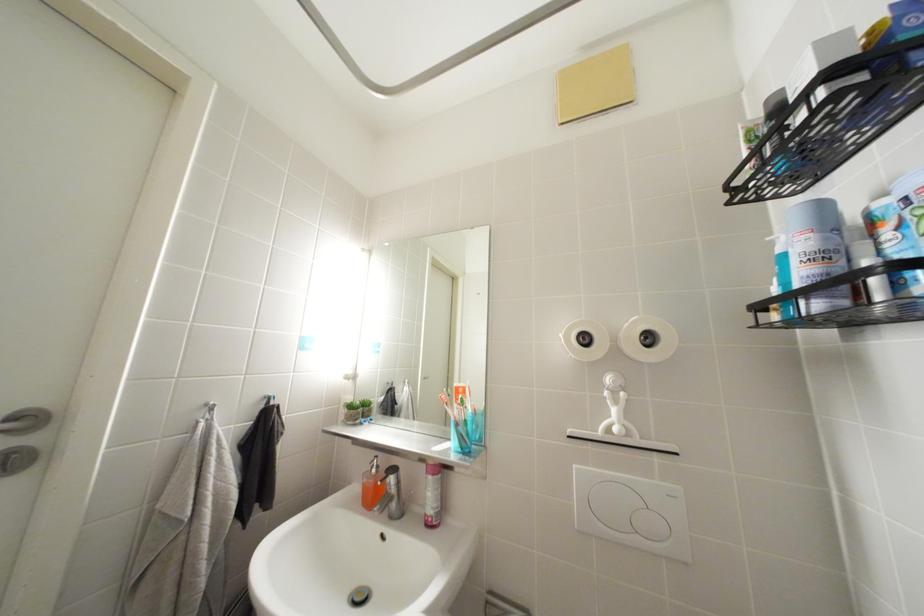
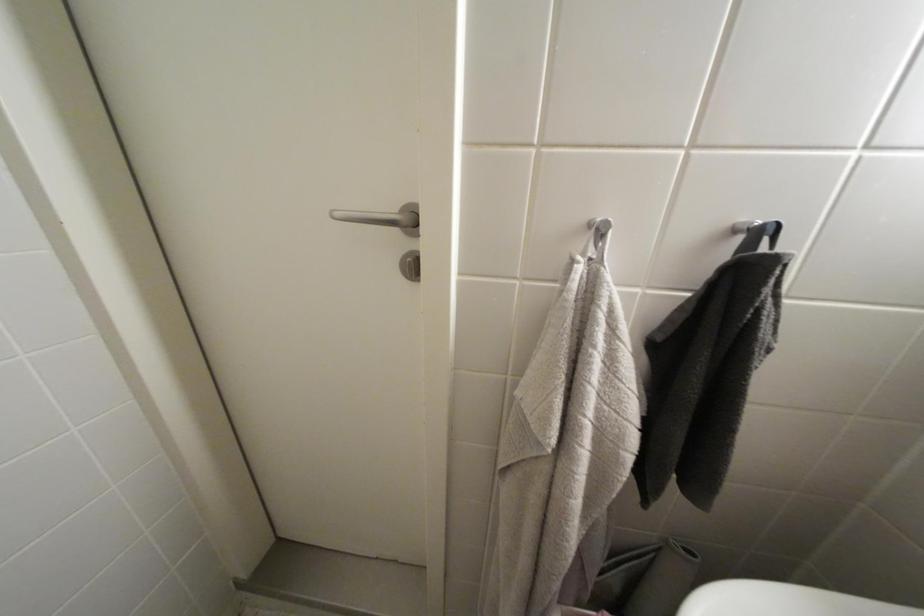
How did the camera likely rotate?

The rotation direction of the camera is left-down.